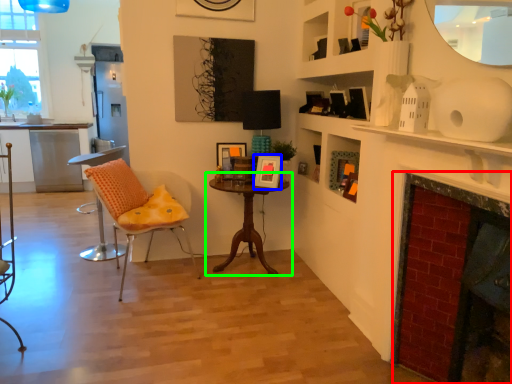
Question: Estimate the real-world distances between objects in this image. Which object is farther from fireplace (highlighted by a red box), picture frame (highlighted by a blue box) or table (highlighted by a green box)?

Choices:
 (A) picture frame
 (B) table

Answer: (B)